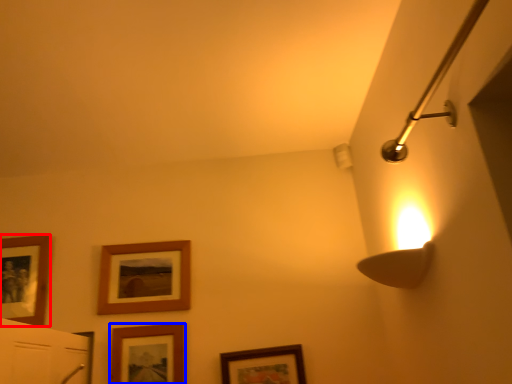
Question: Which point is closer to the camera, picture frame (highlighted by a red box) or picture frame (highlighted by a blue box)?

Choices:
 (A) picture frame
 (B) picture frame

Answer: (B)